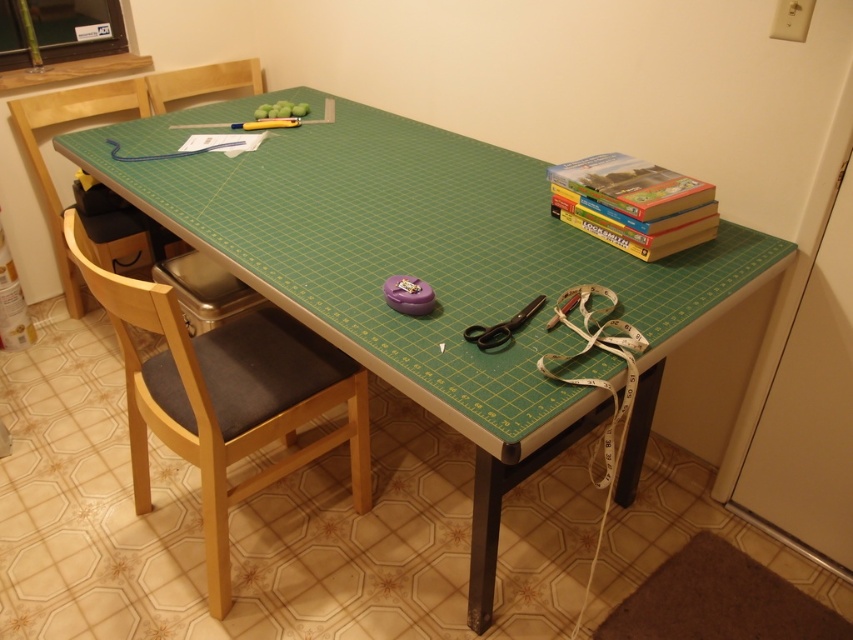
You are a guest entering the workspace and need to sit down. The wooden chair at center and the black plastic scissors at center are in your way. Which one should you move to make space?

The wooden chair at center is taller than the black plastic scissors at center, so you should move the wooden chair at center to make space since it occupies more vertical space and might block your path more effectively.

You are sitting on the wooden chair at center and want to reach the hardcover books at upper right. Can you easily access them without moving the chair?

The wooden chair at center is in front of the hardcover books at upper right, which means the chair is blocking direct access to the books. To reach them, you would need to move the chair out of the way.